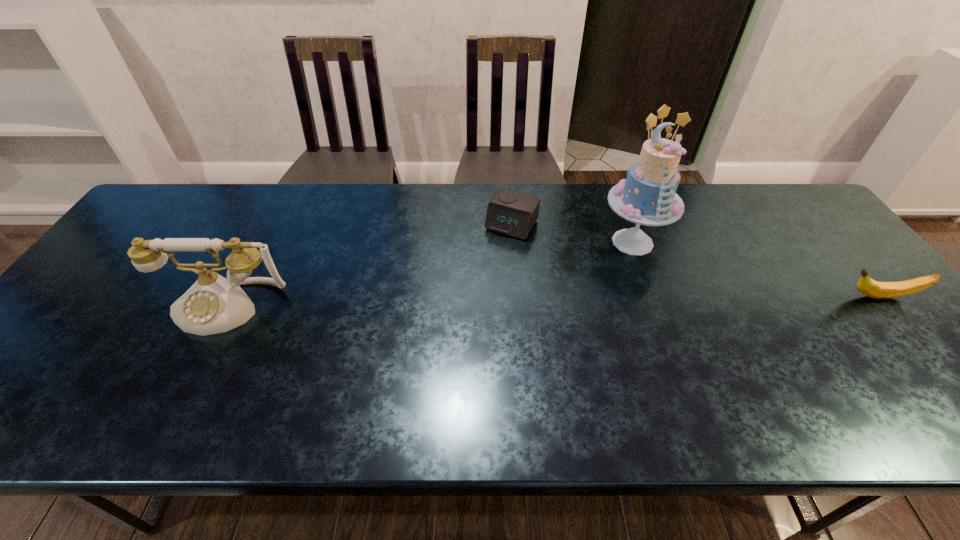
The width and height of the screenshot is (960, 540). Identify the location of free space on the desktop that is between the telephone and the banana and is positioned with a ladder on the side of the second object from right to left. (624, 301).

Identify the location of vacant space on the desktop that is between the telephone and the rightmost object and is positioned on the front-facing side of the alarm clock. The width and height of the screenshot is (960, 540). (463, 303).